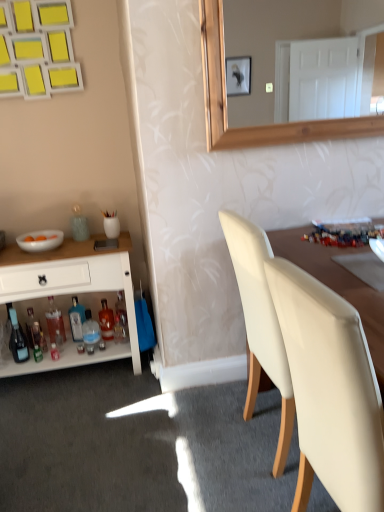
What is the approximate height of translucent glass bottle at lower left, which is the 5th bottle from left to right?

translucent glass bottle at lower left, which is the 5th bottle from left to right, is 9.04 inches tall.

Describe the element at coordinates (32, 328) in the screenshot. I see `translucent glass bottle at lower left, positioned as the sixth bottle in right-to-left order` at that location.

What is the approximate height of translucent glass bottle at lower left, which is the 1th bottle from right to left?

29.36 centimeters.

The image size is (384, 512). What do you see at coordinates (76, 319) in the screenshot?
I see `blue glass bottle at lower left, the fourth bottle from the right` at bounding box center [76, 319].

Image resolution: width=384 pixels, height=512 pixels. What do you see at coordinates (106, 321) in the screenshot?
I see `translucent glass bottle at lower left, the 6th bottle positioned from the left` at bounding box center [106, 321].

You are a GUI agent. You are given a task and a screenshot of the screen. Output one action in this format:
    pyautogui.click(x=<x>, y=<y>)
    Task: Click on the shiny glass bottle at lower left, the first bottle when ordered from left to right
    
    Given the screenshot: What is the action you would take?
    pyautogui.click(x=18, y=339)

You are a GUI agent. You are given a task and a screenshot of the screen. Output one action in this format:
    pyautogui.click(x=<x>, y=<y>)
    Task: Click on the translucent glass bottle at lower left, which is counted as the third bottle, starting from the right
    The width and height of the screenshot is (384, 512).
    Given the screenshot: What is the action you would take?
    (90, 333)

From a real-world perspective, between translucent glass bottle at lower left, placed as the second bottle when sorted from right to left, and shiny glass bottle at lower left, which ranks as the 7th bottle in right-to-left order, who is vertically lower?

translucent glass bottle at lower left, placed as the second bottle when sorted from right to left, is physically lower.

Between translucent glass bottle at lower left, placed as the second bottle when sorted from right to left, and shiny glass bottle at lower left, the first bottle when ordered from left to right, which one has larger width?

With larger width is translucent glass bottle at lower left, placed as the second bottle when sorted from right to left.

From a real-world perspective, starting from the translucent glass bottle at lower left, the 6th bottle positioned from the left, which bottle is the 4th one vertically above it? Please provide its 2D coordinates.

[(18, 339)]

Is translucent glass bottle at lower left, placed as the second bottle when sorted from right to left, in front of shiny glass bottle at lower left, which ranks as the 7th bottle in right-to-left order?

No, it is behind shiny glass bottle at lower left, which ranks as the 7th bottle in right-to-left order.

Is shiny glass bottle at lower left, which ranks as the 7th bottle in right-to-left order, at the back of blue glass bottle at lower left, positioned as the 4th bottle in left-to-right order?

That's not correct — blue glass bottle at lower left, positioned as the 4th bottle in left-to-right order, is not looking away from shiny glass bottle at lower left, which ranks as the 7th bottle in right-to-left order.

Relative to shiny glass bottle at lower left, the first bottle when ordered from left to right, is blue glass bottle at lower left, the fourth bottle from the right, in front or behind?

Visually, blue glass bottle at lower left, the fourth bottle from the right, is located behind shiny glass bottle at lower left, the first bottle when ordered from left to right.

What's the angular difference between blue glass bottle at lower left, positioned as the 4th bottle in left-to-right order, and shiny glass bottle at lower left, which ranks as the 7th bottle in right-to-left order,'s facing directions?

A: blue glass bottle at lower left, positioned as the 4th bottle in left-to-right order, and shiny glass bottle at lower left, which ranks as the 7th bottle in right-to-left order, are facing 19.8 degrees away from each other.

Is blue glass bottle at lower left, positioned as the 4th bottle in left-to-right order, bigger or smaller than shiny glass bottle at lower left, the first bottle when ordered from left to right?

blue glass bottle at lower left, positioned as the 4th bottle in left-to-right order, is bigger than shiny glass bottle at lower left, the first bottle when ordered from left to right.

Is translucent glass bottle at lower left, which is the 1th bottle from right to left, positioned with its back to white matte chair at right?

translucent glass bottle at lower left, which is the 1th bottle from right to left, is not turned away from white matte chair at right.

This screenshot has width=384, height=512. I want to click on the 3rd bottle below the white matte chair at right (from a real-world perspective), so click(121, 319).

Based on their positions, is translucent glass bottle at lower left, positioned as the 7th bottle in left-to-right order, located to the left or right of white matte chair at right?

From the image, it's evident that translucent glass bottle at lower left, positioned as the 7th bottle in left-to-right order, is to the left of white matte chair at right.

Relative to white matte chair at right, is translucent glass bottle at lower left, positioned as the 7th bottle in left-to-right order, in front or behind?

translucent glass bottle at lower left, positioned as the 7th bottle in left-to-right order, is positioned farther from the viewer than white matte chair at right.

Between white glossy cabinet at left and white glossy bowl at left, which one has larger size?

white glossy cabinet at left is bigger.

From the image's perspective, which is above, white glossy cabinet at left or white glossy bowl at left?

white glossy bowl at left, from the image's perspective.

Looking at this image, would you say white glossy cabinet at left is to the left or to the right of white glossy bowl at left in the picture?

From the image, it's evident that white glossy cabinet at left is to the right of white glossy bowl at left.

Is white glossy cabinet at left inside or outside of translucent glass bottle at lower left, positioned as the 5th bottle in right-to-left order?

white glossy cabinet at left is outside translucent glass bottle at lower left, positioned as the 5th bottle in right-to-left order.

Image resolution: width=384 pixels, height=512 pixels. Find the location of `bottle that is the 3rd one when counting downward from the white glossy cabinet at left (from the image's perspective)`. bottle that is the 3rd one when counting downward from the white glossy cabinet at left (from the image's perspective) is located at coordinates (54, 321).

Which object is positioned more to the right, white glossy cabinet at left or translucent glass bottle at lower left, positioned as the 5th bottle in right-to-left order?

From the viewer's perspective, white glossy cabinet at left appears more on the right side.

Find the location of a particular element. The height and width of the screenshot is (512, 384). bottle that is the 3rd one above the translucent glass bottle at lower left, positioned as the sixth bottle in right-to-left order (from a real-world perspective) is located at coordinates (76, 319).

Is blue glass bottle at lower left, the fourth bottle from the right, positioned with its back to translucent glass bottle at lower left, the 2th bottle from the left?

No, blue glass bottle at lower left, the fourth bottle from the right,'s orientation is not away from translucent glass bottle at lower left, the 2th bottle from the left.

Considering the sizes of objects blue glass bottle at lower left, positioned as the 4th bottle in left-to-right order, and translucent glass bottle at lower left, positioned as the sixth bottle in right-to-left order, in the image provided, who is smaller, blue glass bottle at lower left, positioned as the 4th bottle in left-to-right order, or translucent glass bottle at lower left, positioned as the sixth bottle in right-to-left order,?

translucent glass bottle at lower left, positioned as the sixth bottle in right-to-left order.

Looking at this image, is translucent glass bottle at lower left, which is the 1th bottle from right to left, oriented away from shiny glass bottle at lower left, which ranks as the 7th bottle in right-to-left order?

translucent glass bottle at lower left, which is the 1th bottle from right to left, is not turned away from shiny glass bottle at lower left, which ranks as the 7th bottle in right-to-left order.

From the image's perspective, which one is positioned higher, translucent glass bottle at lower left, positioned as the 7th bottle in left-to-right order, or shiny glass bottle at lower left, the first bottle when ordered from left to right?

From the image's view, translucent glass bottle at lower left, positioned as the 7th bottle in left-to-right order, is above.

How different are the orientations of translucent glass bottle at lower left, positioned as the 7th bottle in left-to-right order, and shiny glass bottle at lower left, the first bottle when ordered from left to right, in degrees?

The angular difference between translucent glass bottle at lower left, positioned as the 7th bottle in left-to-right order, and shiny glass bottle at lower left, the first bottle when ordered from left to right, is 23.1 degrees.

From a real-world perspective, is translucent glass bottle at lower left, which is the 1th bottle from right to left, located beneath shiny glass bottle at lower left, which ranks as the 7th bottle in right-to-left order?

Yes.

From the shiny glass bottle at lower left, the first bottle when ordered from left to right, count 5th bottle to the right and point to it. Please provide its 2D coordinates.

[(106, 321)]

Locate an element on the screen. the 6th bottle behind the shiny glass bottle at lower left, the first bottle when ordered from left to right, counting from the anchor's position is located at coordinates (76, 319).

Based on their spatial positions, is white glossy bowl at left or blue glass bottle at lower left, the fourth bottle from the right, further from translucent glass bottle at lower left, marked as the 3th bottle in a left-to-right arrangement?

white glossy bowl at left is positioned further to the anchor translucent glass bottle at lower left, marked as the 3th bottle in a left-to-right arrangement.

From the image, which object appears to be nearer to white glossy cabinet at left, blue glass bottle at lower left, the fourth bottle from the right, or translucent glass bottle at lower left, which is counted as the third bottle, starting from the right?

blue glass bottle at lower left, the fourth bottle from the right.

Looking at this image, estimate the real-world distances between objects in this image. Which object is closer to shiny glass bottle at lower left, the first bottle when ordered from left to right, white matte chair at right or translucent glass bottle at lower left, marked as the 3th bottle in a left-to-right arrangement?

Based on the image, translucent glass bottle at lower left, marked as the 3th bottle in a left-to-right arrangement, appears to be nearer to shiny glass bottle at lower left, the first bottle when ordered from left to right.

Consider the image. From the image, which object appears to be nearer to shiny glass bottle at lower left, which ranks as the 7th bottle in right-to-left order, translucent glass bottle at lower left, which is counted as the third bottle, starting from the right, or translucent glass bottle at lower left, the 6th bottle positioned from the left?

translucent glass bottle at lower left, which is counted as the third bottle, starting from the right, lies closer to shiny glass bottle at lower left, which ranks as the 7th bottle in right-to-left order, than the other object.

From the image, which object appears to be farther from blue glass bottle at lower left, the fourth bottle from the right, white matte chair at right or white glossy cabinet at left?

white matte chair at right.

From the image, which object appears to be nearer to translucent glass bottle at lower left, which is the 5th bottle from left to right, white glossy bowl at left or translucent glass bottle at lower left, positioned as the sixth bottle in right-to-left order?

translucent glass bottle at lower left, positioned as the sixth bottle in right-to-left order, lies closer to translucent glass bottle at lower left, which is the 5th bottle from left to right, than the other object.

Which object lies further to the anchor point translucent glass bottle at lower left, placed as the second bottle when sorted from right to left, translucent glass bottle at lower left, positioned as the 7th bottle in left-to-right order, or white matte chair at right?

Based on the image, white matte chair at right appears to be further to translucent glass bottle at lower left, placed as the second bottle when sorted from right to left.

Estimate the real-world distances between objects in this image. Which object is further from translucent glass bottle at lower left, the 6th bottle positioned from the left, white matte chair at right or translucent glass bottle at lower left, marked as the 3th bottle in a left-to-right arrangement?

white matte chair at right is further to translucent glass bottle at lower left, the 6th bottle positioned from the left.

You are a GUI agent. You are given a task and a screenshot of the screen. Output one action in this format:
    pyautogui.click(x=<x>, y=<y>)
    Task: Click on the cabinetry that lies between white glossy bowl at left and blue glass bottle at lower left, the fourth bottle from the right, from top to bottom
    
    Given the screenshot: What is the action you would take?
    pyautogui.click(x=70, y=292)

This screenshot has width=384, height=512. I want to click on bottle located between blue glass bottle at lower left, the fourth bottle from the right, and translucent glass bottle at lower left, placed as the second bottle when sorted from right to left, in the left-right direction, so click(90, 333).

Find the location of a particular element. cabinetry between white glossy bowl at left and translucent glass bottle at lower left, which is the 5th bottle from left to right, in the vertical direction is located at coordinates (70, 292).

Image resolution: width=384 pixels, height=512 pixels. Find the location of `bowl located between white matte chair at right and translucent glass bottle at lower left, which is counted as the third bottle, starting from the right, in the depth direction`. bowl located between white matte chair at right and translucent glass bottle at lower left, which is counted as the third bottle, starting from the right, in the depth direction is located at coordinates (40, 240).